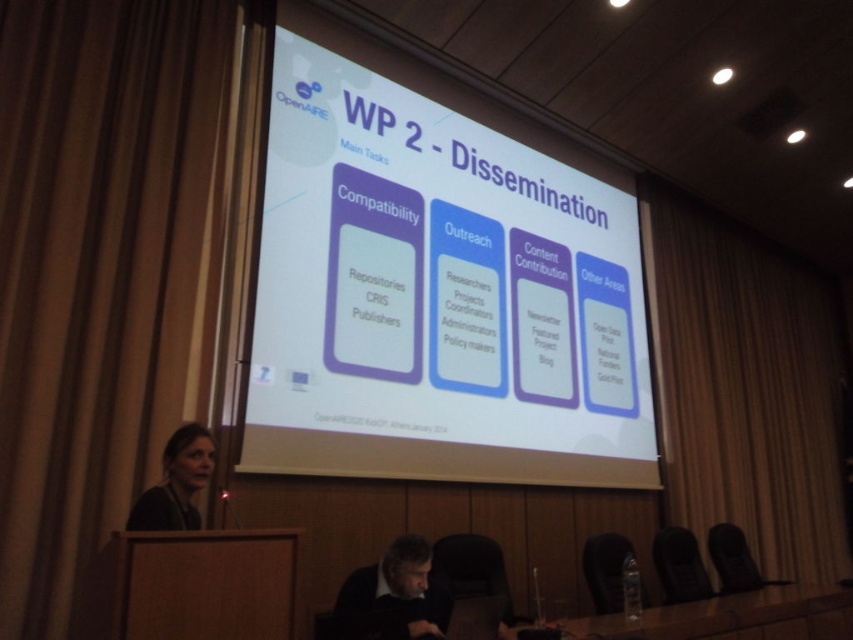
You are organizing a presentation in this room and need to adjust the lighting. You have a spotlight that needs to be placed between the brown fabric curtain at right and the transparent plastic table at lower center. Can you position it there without blocking the projection screen?

The brown fabric curtain at right is to the right of the transparent plastic table at lower center, so placing the spotlight between them would not interfere with the projection screen as they are positioned to the side of the screen area.

Consider the image. You are a stagehand in the conference room and need to move a 5.5 meter long extension cord from the matte black hair at lower left to the brown fabric curtain at right. Will the cord reach?

The brown fabric curtain at right is 5.46 meters from the matte black hair at lower left. Since the extension cord is 5.5 meters long, it will just barely reach.

You are standing in the conference room and want to reach a point marked at coordinates point (316, 424). If your current position is 10 feet away from the camera, will you need to move closer or farther to reach that point?

The distance of point (316, 424) from camera is 11.94 feet. Since you are currently 10 feet away from the camera, you need to move farther to reach the point as it is 1.94 feet beyond your current position.